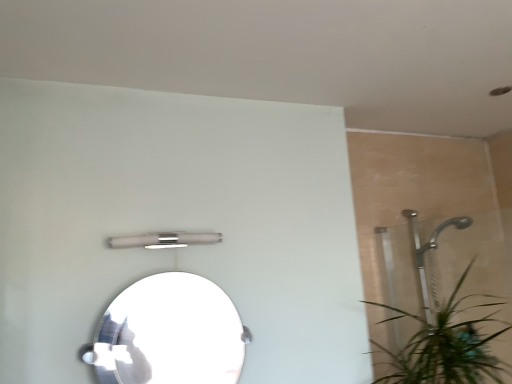
Question: Considering the relative sizes of satin nickel light fixture at upper center and clear glass mirror at center in the image provided, is satin nickel light fixture at upper center wider than clear glass mirror at center?

Choices:
 (A) no
 (B) yes

Answer: (A)

Question: Are satin nickel light fixture at upper center and clear glass mirror at center far apart?

Choices:
 (A) yes
 (B) no

Answer: (B)

Question: From a real-world perspective, is satin nickel light fixture at upper center beneath clear glass mirror at center?

Choices:
 (A) yes
 (B) no

Answer: (B)

Question: Is satin nickel light fixture at upper center closer to camera compared to clear glass mirror at center?

Choices:
 (A) yes
 (B) no

Answer: (B)

Question: Does satin nickel light fixture at upper center turn towards clear glass mirror at center?

Choices:
 (A) yes
 (B) no

Answer: (B)

Question: Is satin nickel light fixture at upper center outside of clear glass mirror at center?

Choices:
 (A) yes
 (B) no

Answer: (A)

Question: Can you confirm if clear glass mirror at center is taller than satin nickel light fixture at upper center?

Choices:
 (A) yes
 (B) no

Answer: (A)

Question: Is satin nickel light fixture at upper center a part of clear glass mirror at center?

Choices:
 (A) no
 (B) yes

Answer: (A)

Question: Does clear glass mirror at center have a smaller size compared to satin nickel light fixture at upper center?

Choices:
 (A) yes
 (B) no

Answer: (B)

Question: Is clear glass mirror at center beside satin nickel light fixture at upper center?

Choices:
 (A) no
 (B) yes

Answer: (A)

Question: From a real-world perspective, is clear glass mirror at center positioned under satin nickel light fixture at upper center based on gravity?

Choices:
 (A) no
 (B) yes

Answer: (B)

Question: From a real-world perspective, is clear glass mirror at center positioned over satin nickel light fixture at upper center based on gravity?

Choices:
 (A) no
 (B) yes

Answer: (A)

Question: Is point 234,327 positioned closer to the camera than point 144,246?

Choices:
 (A) closer
 (B) farther

Answer: (A)